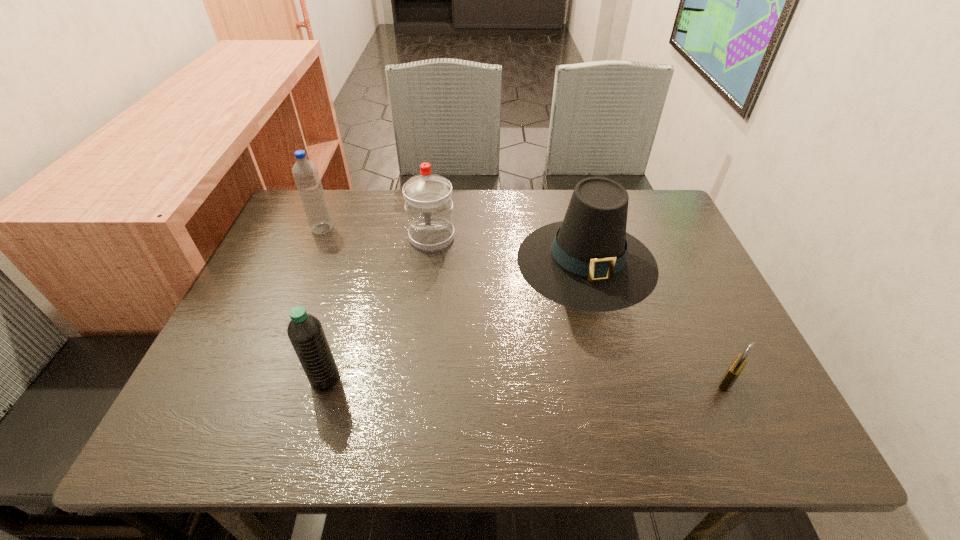
In order to click on unoccupied position between the leftmost water bottle and the rightmost object in this screenshot , I will do `click(525, 305)`.

Identify the location of blank region between the third object from right to left and the fourth object from left to right. This screenshot has height=540, width=960. (509, 249).

The image size is (960, 540). I want to click on free area in between the leftmost object and the fourth object from left to right, so click(454, 245).

Locate an element on the screen. free area in between the second water bottle from right to left and the rightmost water bottle is located at coordinates (378, 307).

At what (x,y) coordinates should I click in order to perform the action: click on object that is the third closest to the leftmost water bottle. Please return your answer as a coordinate pair (x, y). This screenshot has height=540, width=960. Looking at the image, I should click on (588, 261).

Locate an element on the screen. This screenshot has height=540, width=960. object that is the third closest to the hat is located at coordinates click(x=305, y=331).

Locate which water bottle is the closest to the hat. Please provide its 2D coordinates. Your answer should be formatted as a tuple, i.e. [(x, y)], where the tuple contains the x and y coordinates of a point satisfying the conditions above.

[(428, 197)]

Image resolution: width=960 pixels, height=540 pixels. Identify the location of water bottle identified as the second closest to the padlock. (305, 331).

This screenshot has height=540, width=960. Identify the location of vacant space that satisfies the following two spatial constraints: 1. on the handle side of the padlock; 2. on the right side of the third object from left to right. (414, 381).

Find the location of `blank area in the image that satisfies the following two spatial constraints: 1. on the front side of the fourth object from right to left; 2. on the left side of the leftmost water bottle`. blank area in the image that satisfies the following two spatial constraints: 1. on the front side of the fourth object from right to left; 2. on the left side of the leftmost water bottle is located at coordinates (260, 378).